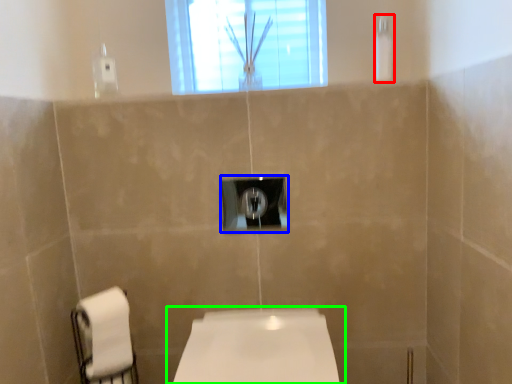
Question: Based on their relative distances, which object is nearer to shower (highlighted by a red box)? Choose from light switch (highlighted by a blue box) and toilet (highlighted by a green box).

Choices:
 (A) light switch
 (B) toilet

Answer: (A)